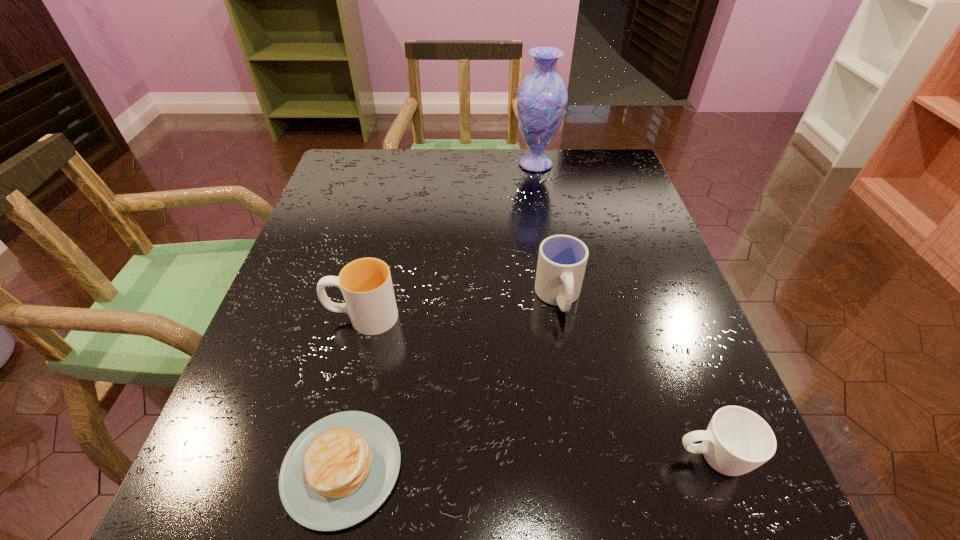
Identify the location of cup that is the second closest to the leftmost cup. The image size is (960, 540). (737, 440).

Locate an element on the screen. The image size is (960, 540). vacant area that satisfies the following two spatial constraints: 1. with the handle on the side of the leftmost cup; 2. on the left side of the tallest object is located at coordinates (399, 164).

The height and width of the screenshot is (540, 960). Find the location of `vacant region that satisfies the following two spatial constraints: 1. with the handle on the side of the farthest object; 2. on the right side of the leftmost cup`. vacant region that satisfies the following two spatial constraints: 1. with the handle on the side of the farthest object; 2. on the right side of the leftmost cup is located at coordinates (399, 164).

Image resolution: width=960 pixels, height=540 pixels. I want to click on free space that satisfies the following two spatial constraints: 1. with the handle on the side of the tallest object; 2. on the right side of the leftmost cup, so click(x=399, y=164).